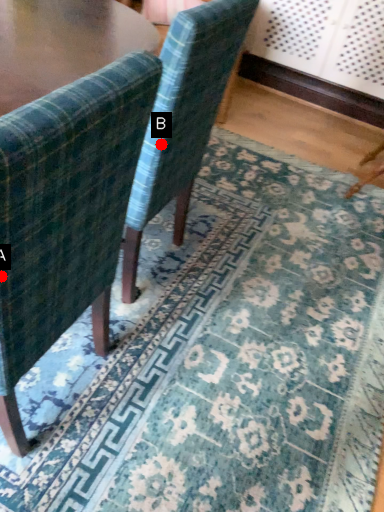
Question: Two points are circled on the image, labeled by A and B beside each circle. Which of the following is the farthest from the observer?

Choices:
 (A) A is further
 (B) B is further

Answer: (B)